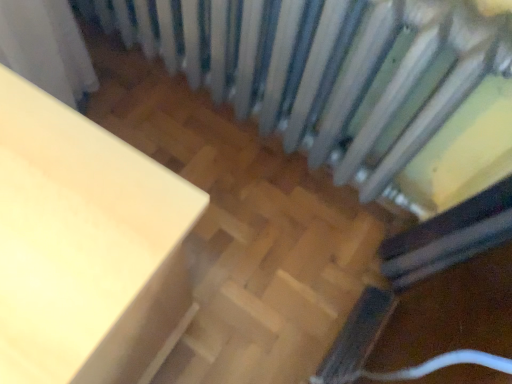
Question: Is white painted radiator at upper center not near matte white table at left?

Choices:
 (A) no
 (B) yes

Answer: (A)

Question: Is white painted radiator at upper center oriented away from matte white table at left?

Choices:
 (A) no
 (B) yes

Answer: (B)

Question: Is white painted radiator at upper center positioned behind matte white table at left?

Choices:
 (A) yes
 (B) no

Answer: (A)

Question: Is white painted radiator at upper center aimed at matte white table at left?

Choices:
 (A) no
 (B) yes

Answer: (B)

Question: Is white painted radiator at upper center positioned beyond the bounds of matte white table at left?

Choices:
 (A) no
 (B) yes

Answer: (B)

Question: From a real-world perspective, is white painted radiator at upper center beneath matte white table at left?

Choices:
 (A) no
 (B) yes

Answer: (A)

Question: Is matte white table at left next to white painted radiator at upper center and touching it?

Choices:
 (A) yes
 (B) no

Answer: (B)

Question: Is matte white table at left taller than white painted radiator at upper center?

Choices:
 (A) no
 (B) yes

Answer: (B)

Question: From the image's perspective, would you say matte white table at left is shown under white painted radiator at upper center?

Choices:
 (A) no
 (B) yes

Answer: (B)

Question: Can you confirm if matte white table at left is bigger than white painted radiator at upper center?

Choices:
 (A) no
 (B) yes

Answer: (B)

Question: Is matte white table at left positioned beyond the bounds of white painted radiator at upper center?

Choices:
 (A) yes
 (B) no

Answer: (A)

Question: Is matte white table at left wider than white painted radiator at upper center?

Choices:
 (A) yes
 (B) no

Answer: (A)

Question: Considering the positions of matte white table at left and white painted radiator at upper center in the image, is matte white table at left wider or thinner than white painted radiator at upper center?

Choices:
 (A) thin
 (B) wide

Answer: (B)